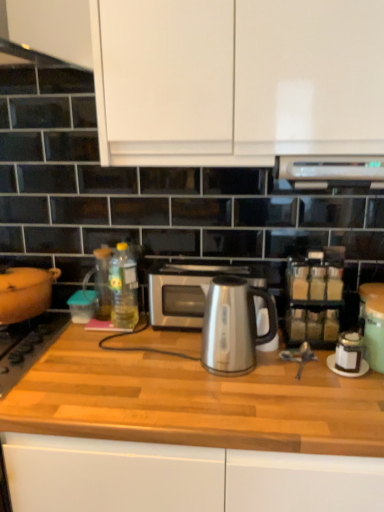
Question: In the image, is translucent glass spice rack at right on the left side or the right side of transparent glass bottle at center, placed as the 2th bottle when sorted from right to left?

Choices:
 (A) left
 (B) right

Answer: (B)

Question: Would you say translucent glass spice rack at right is inside or outside transparent glass bottle at center, which ranks as the first bottle in left-to-right order?

Choices:
 (A) outside
 (B) inside

Answer: (A)

Question: Which object is the closest to the translucent glass spice rack at right?

Choices:
 (A) satin silver kettle at center
 (B) transparent glass bottle at center, placed as the 2th bottle when sorted from right to left
 (C) satin silver microwave at center
 (D) matte orange pot at left
 (E) translucent yellow bottle at center, which appears as the second bottle when viewed from the left

Answer: (A)

Question: Which is nearer to the satin silver kettle at center?

Choices:
 (A) translucent yellow bottle at center, which appears as the second bottle when viewed from the left
 (B) translucent glass spice rack at right
 (C) satin silver microwave at center
 (D) black glass gas stove at left
 (E) white matte cabinet at upper center

Answer: (C)